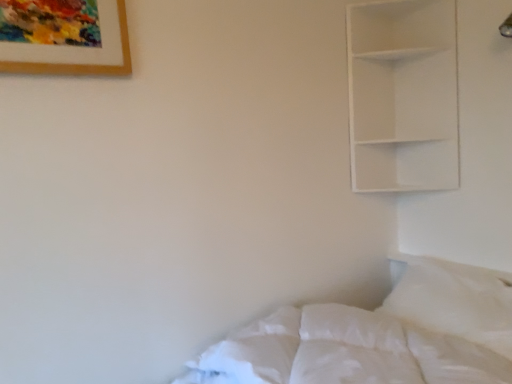
Question: From a real-world perspective, does white soft pillow at lower right sit lower than white soft bed at lower right?

Choices:
 (A) no
 (B) yes

Answer: (A)

Question: From the image's perspective, is white soft pillow at lower right under white soft bed at lower right?

Choices:
 (A) yes
 (B) no

Answer: (B)

Question: Could white soft bed at lower right be considered to be inside white soft pillow at lower right?

Choices:
 (A) no
 (B) yes

Answer: (A)

Question: From a real-world perspective, is white soft pillow at lower right physically above white soft bed at lower right?

Choices:
 (A) yes
 (B) no

Answer: (A)

Question: Is white soft pillow at lower right bigger than white soft bed at lower right?

Choices:
 (A) no
 (B) yes

Answer: (A)

Question: Is white soft pillow at lower right to the left of white soft bed at lower right from the viewer's perspective?

Choices:
 (A) no
 (B) yes

Answer: (A)

Question: Can you confirm if white soft bed at lower right is taller than white matte shelf at upper right?

Choices:
 (A) no
 (B) yes

Answer: (A)

Question: From a real-world perspective, does white soft bed at lower right sit lower than white matte shelf at upper right?

Choices:
 (A) no
 (B) yes

Answer: (B)

Question: Is there a large distance between white soft bed at lower right and white matte shelf at upper right?

Choices:
 (A) no
 (B) yes

Answer: (A)

Question: Is white soft bed at lower right shorter than white matte shelf at upper right?

Choices:
 (A) no
 (B) yes

Answer: (B)

Question: Is the depth of white soft bed at lower right greater than that of white matte shelf at upper right?

Choices:
 (A) no
 (B) yes

Answer: (A)

Question: Does white soft bed at lower right have a smaller size compared to white matte shelf at upper right?

Choices:
 (A) no
 (B) yes

Answer: (A)

Question: Considering the relative sizes of wooden framed artwork at upper left and white soft pillow at lower right in the image provided, is wooden framed artwork at upper left bigger than white soft pillow at lower right?

Choices:
 (A) yes
 (B) no

Answer: (B)